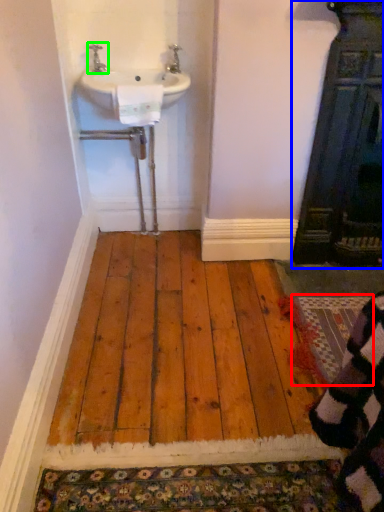
Question: Which is farther away from doormat (highlighted by a red box)? door (highlighted by a blue box) or tap (highlighted by a green box)?

Choices:
 (A) door
 (B) tap

Answer: (B)